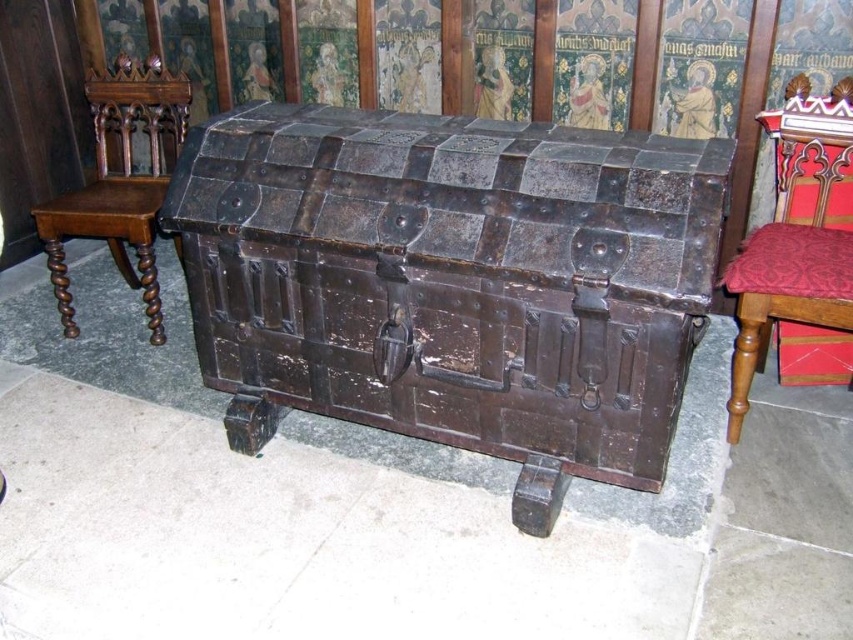
You are standing in front of the antique wooden chest and notice two points marked on it. The first point is at coordinates point (660, 182) and the second is at point (740, 356). Which point is nearer to you?

Point (660, 182) is closer to the viewer than point (740, 356).

You are a visitor in a historical building and want to sit down. You see the rusty metal chest at center and the polished wood chair at left. Which object is closer to the entrance if the entrance is on the left side of the room?

The polished wood chair at left is closer to the entrance because the rusty metal chest at center is positioned on the right side of the polished wood chair at left, meaning the chair is nearer to the left side where the entrance is located.

You are an interior designer arranging a historical room. You have a velvet red cushion at right and a polished wood chair at left. Which object takes up more horizontal space?

The polished wood chair at left takes up more horizontal space because its width is greater than the velvet red cushion at right.